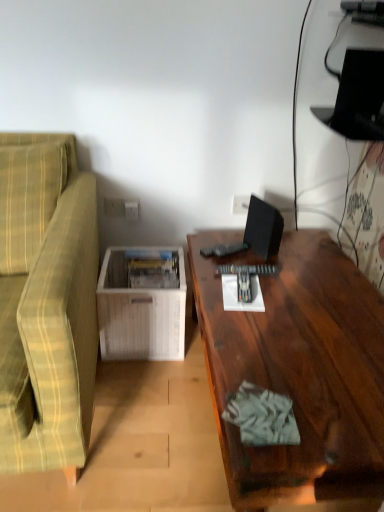
Identify the location of vacant area on top of dark wood desk at right (from a real-world perspective). (301, 311).